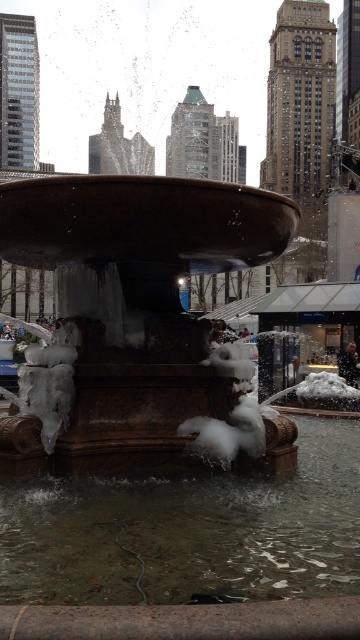
You are standing in the winter scene and want to take a photo of the bronze stone fountain at center and the clear water at fountain center. Which object should you focus on first if you want to capture both in one frame without moving the camera?

The bronze stone fountain at center is to the left of clear water at fountain center, so you should focus on the bronze stone fountain at center first to ensure both are in the frame.

You are a city planner assessing the fountain area for a new sculpture installation. The sculpture will be placed between the bronze stone fountain at center and the clear water at fountain center. Given their sizes, which object should the sculpture be placed closer to for balance?

The bronze stone fountain at center is larger in size than the clear water at fountain center, so the sculpture should be placed closer to the clear water at fountain center to achieve balance.